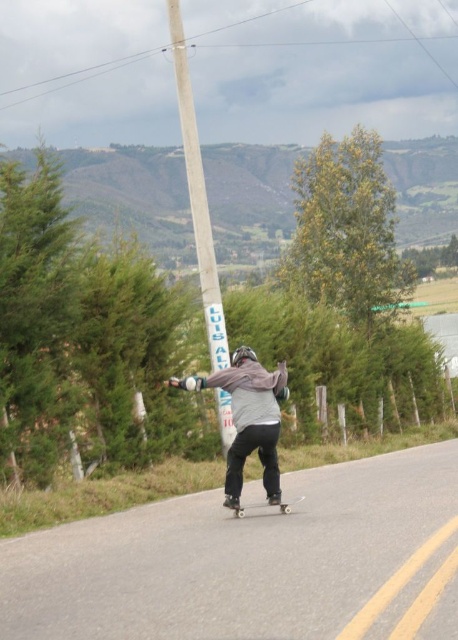
You are a photographer trying to capture the skateboarder from above. Based on the scene, which object, the gray fleece jacket at center or the white plastic skateboard at center, would appear higher in the photo?

The gray fleece jacket at center is above the white plastic skateboard at center, so it would appear higher in the photo.

You are standing at the edge of the road where the skateboarder is moving towards you. There is a gray fleece jacket at center. If you want to pick up the jacket without stepping onto the road, which direction should you move to stay safe?

The gray fleece jacket at center is 28.23 feet away from viewer. To stay safe and avoid stepping onto the road, you should move to the side opposite of the skateboarder to pick up the jacket.